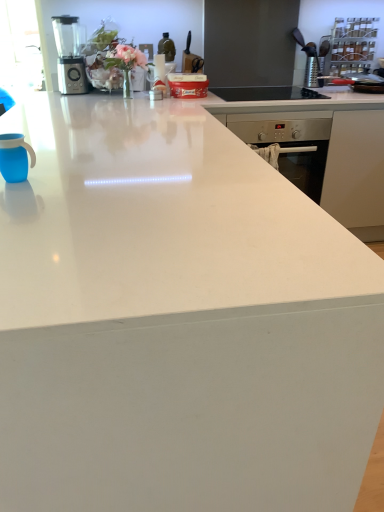
This screenshot has width=384, height=512. Find the location of `free location to the right of blue matte mug at left`. free location to the right of blue matte mug at left is located at coordinates (71, 174).